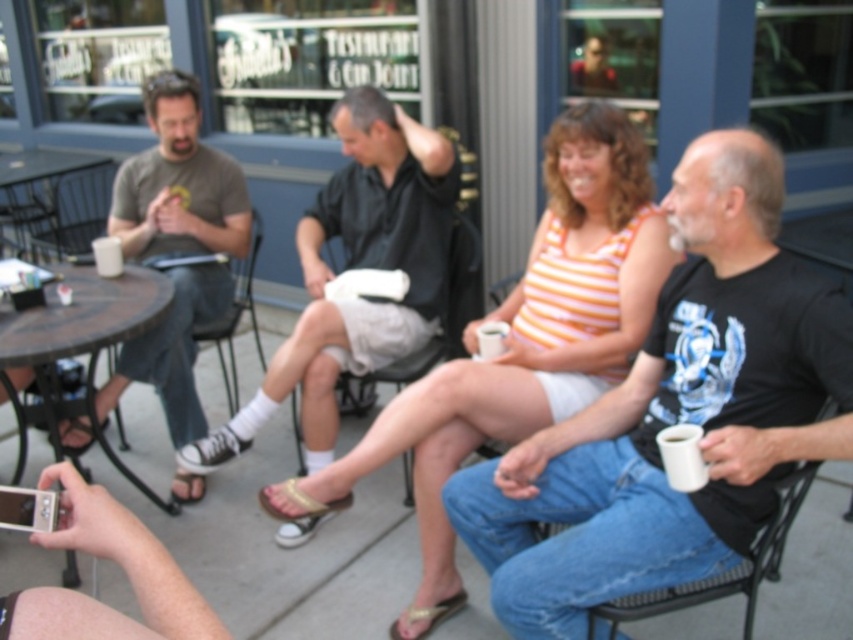
Who is positioned more to the right, black matte t-shirt at center or black plastic chair at left?

From the viewer's perspective, black matte t-shirt at center appears more on the right side.

The height and width of the screenshot is (640, 853). I want to click on black matte t-shirt at center, so click(672, 413).

Which is in front, point (575, 422) or point (253, 316)?

Positioned in front is point (575, 422).

Locate an element on the screen. black matte t-shirt at center is located at coordinates click(672, 413).

Is matte brown shirt at left thinner than black metal chair at lower right?

Correct, matte brown shirt at left's width is less than black metal chair at lower right's.

Does matte brown shirt at left appear on the left side of black metal chair at lower right?

Correct, you'll find matte brown shirt at left to the left of black metal chair at lower right.

Is point (109, 406) positioned before point (762, 547)?

No.

Where is `matte brown shirt at left`? The width and height of the screenshot is (853, 640). matte brown shirt at left is located at coordinates (178, 182).

Can you confirm if black metal table at left is thinner than black metal chair at lower right?

Incorrect, black metal table at left's width is not less than black metal chair at lower right's.

Is black metal table at left wider than black metal chair at lower right?

Indeed, black metal table at left has a greater width compared to black metal chair at lower right.

Is point (61, 227) positioned before point (618, 598)?

No, it is behind (618, 598).

Identify the location of black metal table at left. The height and width of the screenshot is (640, 853). (53, 202).